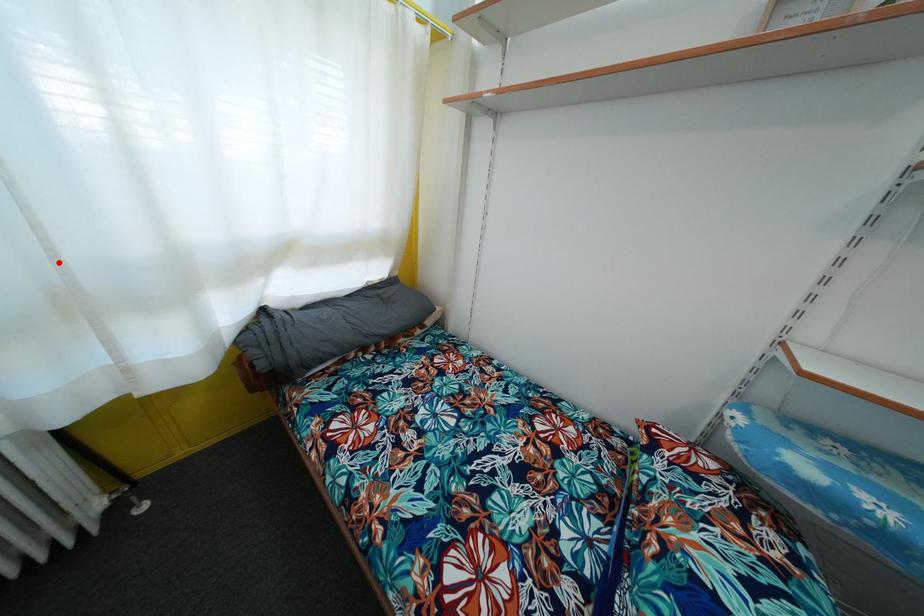
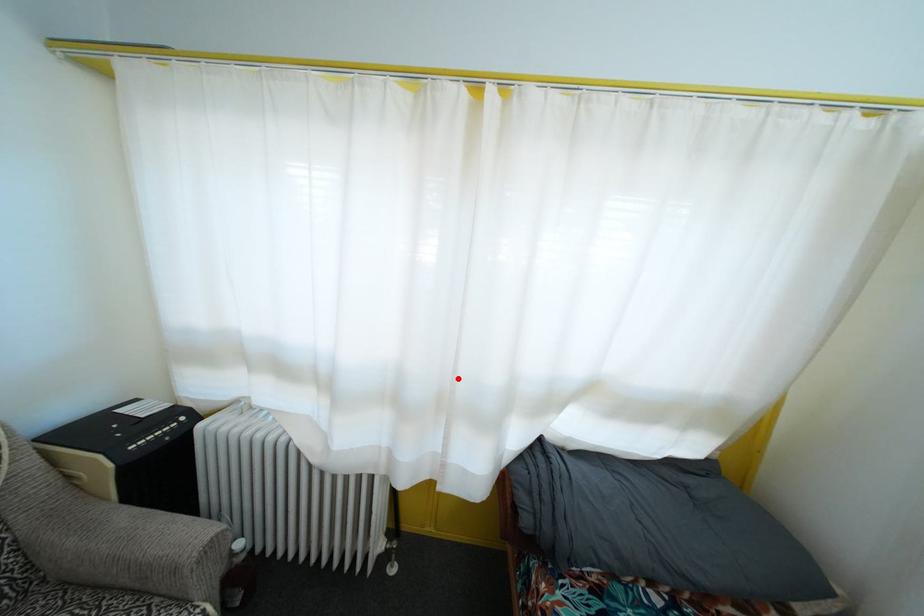
I am providing you with two images of the same scene from different viewpoints. A red point is marked on the first image and another point is marked on the second image. Are the points marked in image1 and image2 representing the same 3D position?

Yes